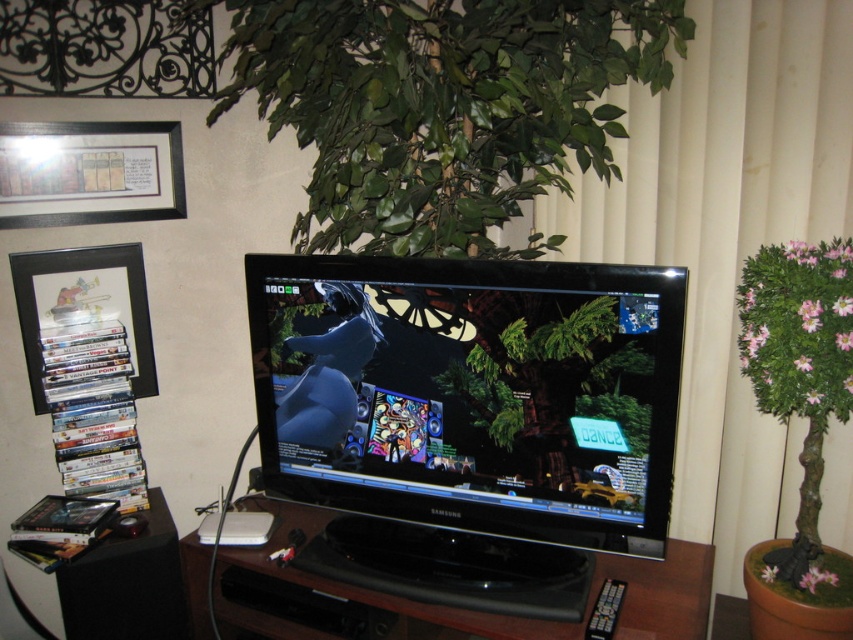
Question: Is white textured curtain at upper right smaller than black wood tv stand at center?

Choices:
 (A) yes
 (B) no

Answer: (B)

Question: Is green leafy plant at upper center to the right of black matte picture frame at upper left from the viewer's perspective?

Choices:
 (A) yes
 (B) no

Answer: (A)

Question: Which object is farther from the camera taking this photo?

Choices:
 (A) black plastic picture frame at left
 (B) black wood tv stand at center
 (C) green leafy plant at upper center
 (D) black matte picture frame at upper left

Answer: (A)

Question: Which of the following is the closest to the observer?

Choices:
 (A) (637, 70)
 (B) (746, 540)
 (C) (202, 609)
 (D) (119, 205)

Answer: (A)

Question: Is green leafy plant at upper center positioned at the back of black matte picture frame at upper left?

Choices:
 (A) no
 (B) yes

Answer: (A)

Question: Which point appears farthest from the camera in this image?

Choices:
 (A) (44, 401)
 (B) (166, 211)
 (C) (537, 186)
 (D) (721, 232)

Answer: (B)